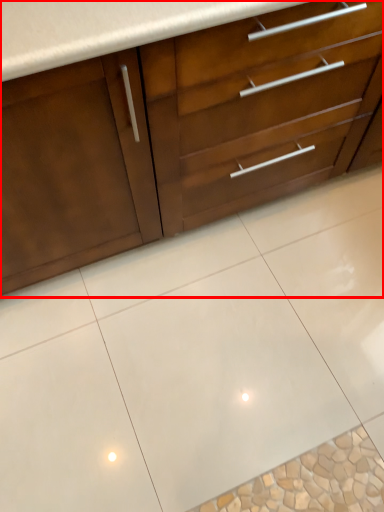
Question: Considering the relative positions of cabinetry (annotated by the red box) and ceramic tile in the image provided, where is cabinetry (annotated by the red box) located with respect to the staircase?

Choices:
 (A) left
 (B) right

Answer: (A)